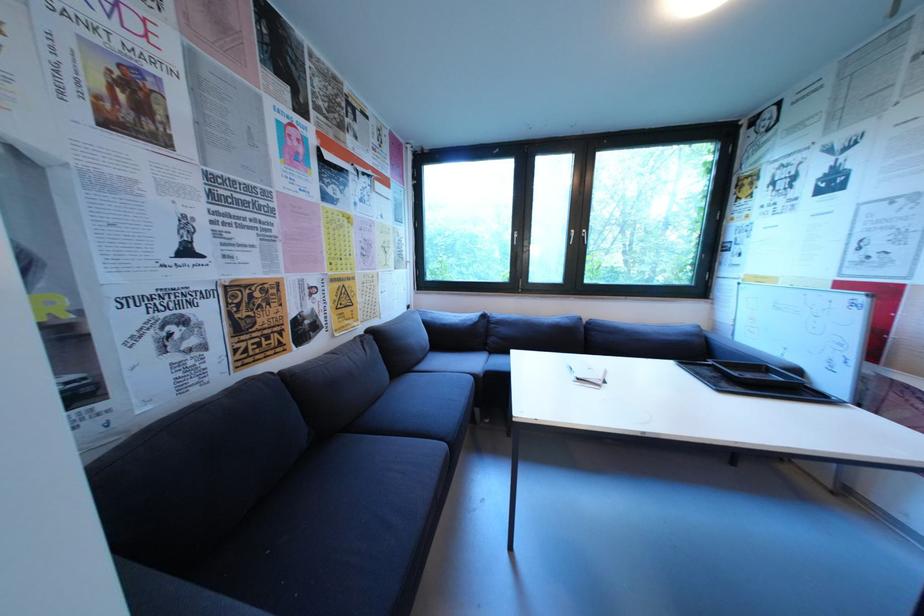
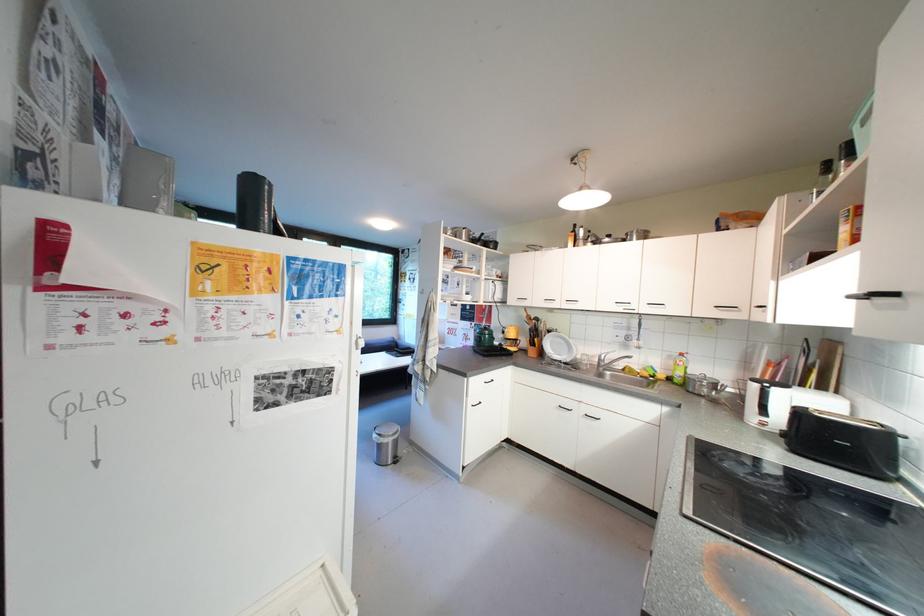
Question: I am providing you with two images of the same scene from different viewpoints. After the viewpoint changes to image2, which objects are now occluded?

Choices:
 (A) metal trash can
 (B) freezer lid handle
 (C) folded white paper
 (D) faucet handle

Answer: (C)